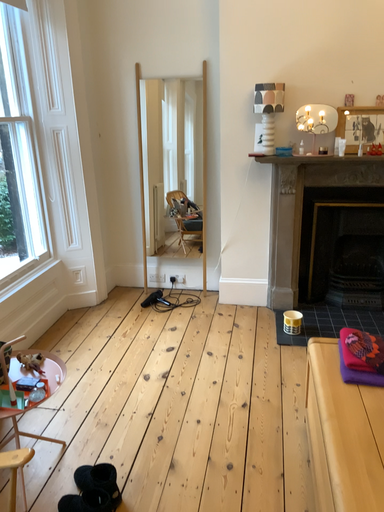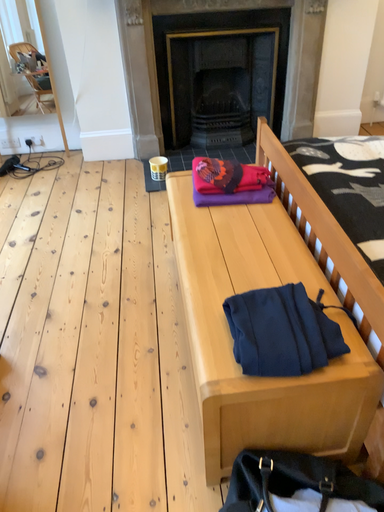
Question: How did the camera likely rotate when shooting the video?

Choices:
 (A) rotated left
 (B) rotated right

Answer: (B)